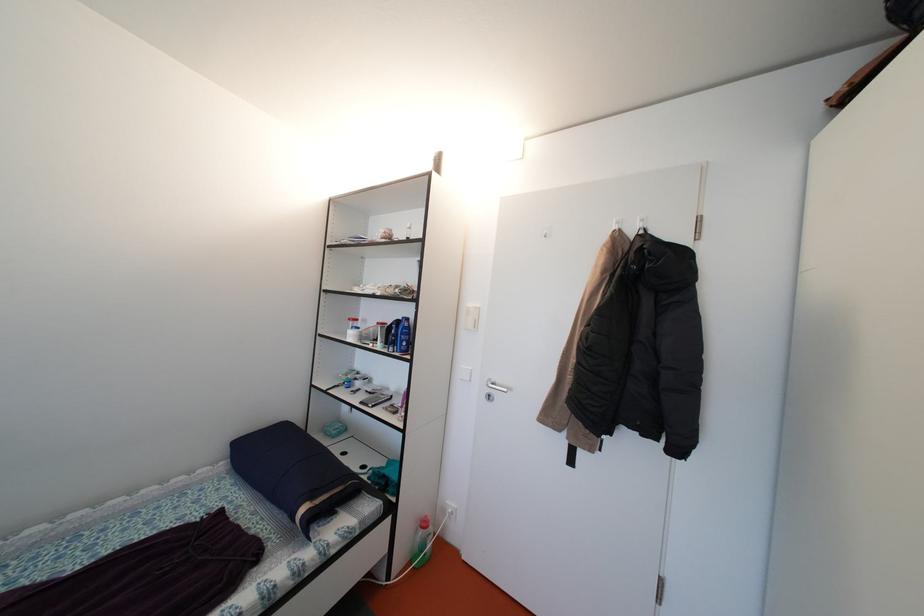
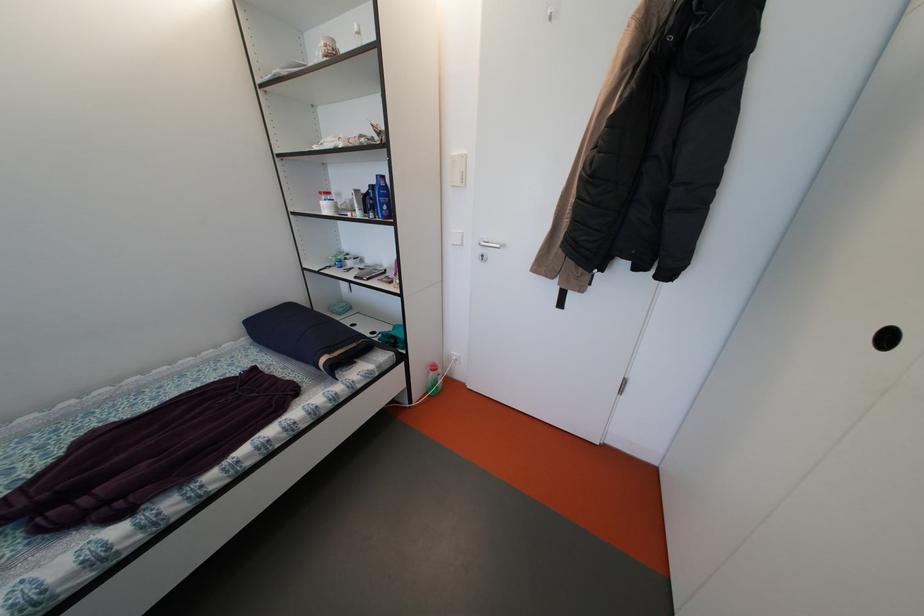
Question: I am providing you with two images of the same scene from different viewpoints. After the viewpoint changes to image2, which objects are now occluded?

Choices:
 (A) white mug
 (B) rolled blue pillow
 (C) silver door handle
 (D) none of these

Answer: (D)